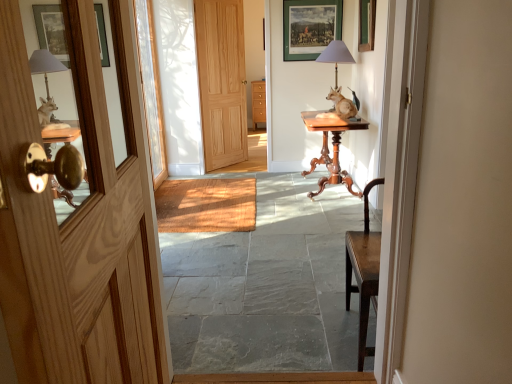
Locate an element on the screen. Image resolution: width=512 pixels, height=384 pixels. vacant space situated above wooden at center (from a real-world perspective) is located at coordinates (206, 198).